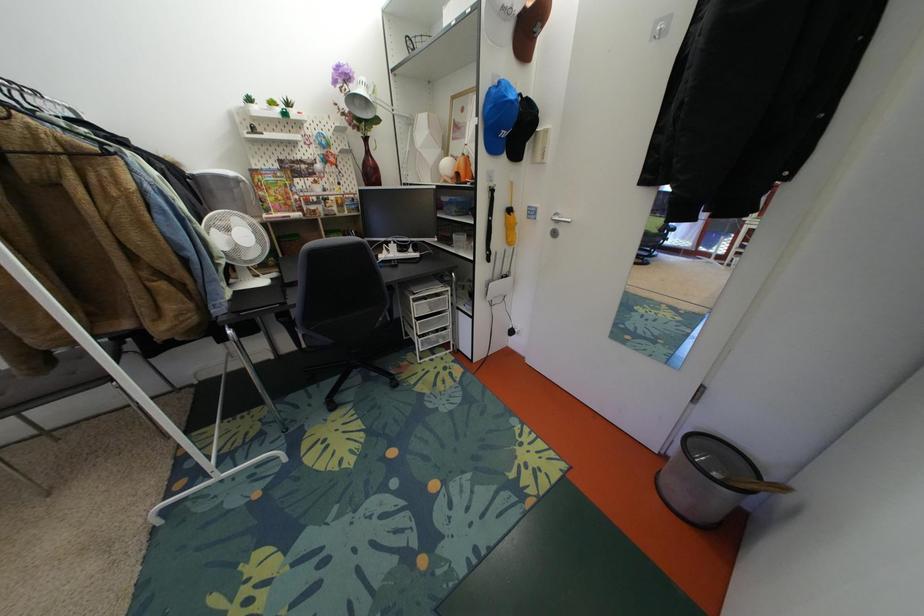
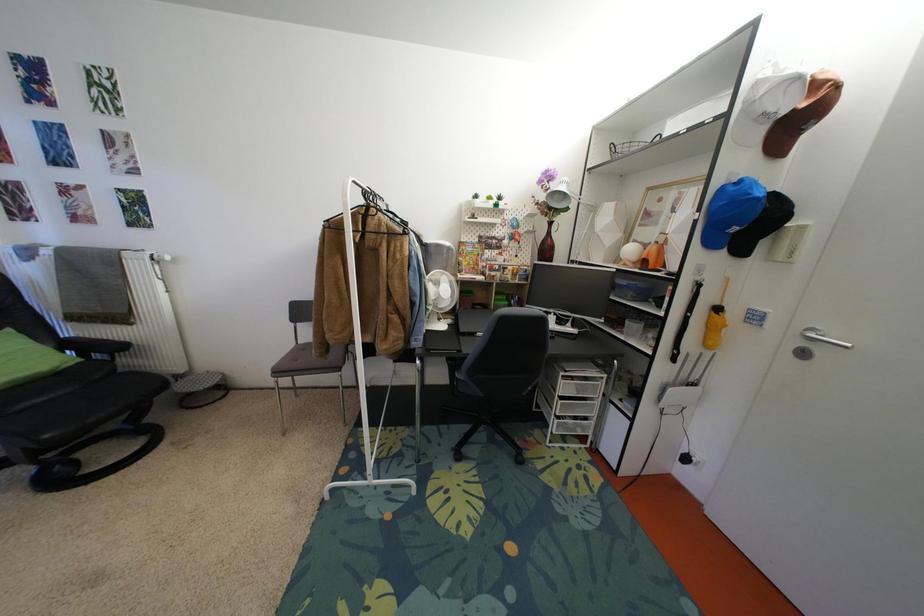
Question: The camera is either moving clockwise (left) or counter-clockwise (right) around the object. The first image is from the beginning of the video and the second image is from the end. Is the camera moving left or right when shooting the video?

Choices:
 (A) Left
 (B) Right

Answer: (B)